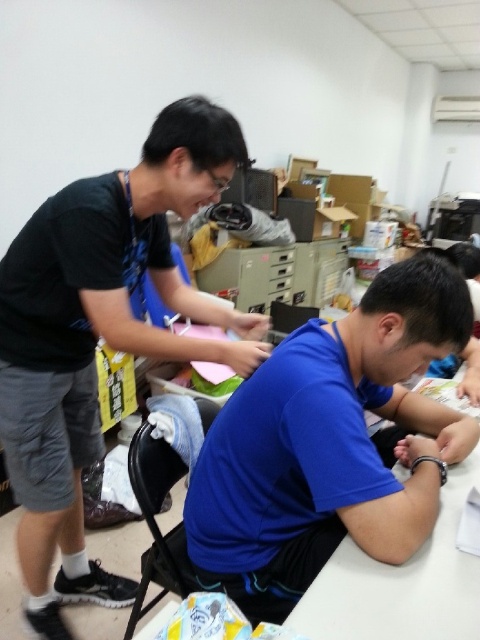
Between blue matte shirt at center and black matte shirt at left, which one has more height?

With more height is black matte shirt at left.

Is blue matte shirt at center shorter than black matte shirt at left?

Yes, blue matte shirt at center is shorter than black matte shirt at left.

Is point (382, 512) closer to camera compared to point (35, 460)?

Yes, it is.

Where is `blue matte shirt at center`? blue matte shirt at center is located at coordinates (331, 444).

Is point (263, 440) positioned in front of point (444, 564)?

No, (263, 440) is behind (444, 564).

Is point (403, 280) behind point (339, 598)?

Yes, point (403, 280) is behind point (339, 598).

Who is more forward, (355, 492) or (445, 563)?

Point (355, 492)

What are the coordinates of `blue matte shirt at center` in the screenshot? It's located at 331,444.

Can you confirm if black matte shirt at left is taller than white glossy table at lower center?

Correct, black matte shirt at left is much taller as white glossy table at lower center.

Does black matte shirt at left have a greater width compared to white glossy table at lower center?

Correct, the width of black matte shirt at left exceeds that of white glossy table at lower center.

Is point (242, 358) farther from camera compared to point (459, 588)?

Yes, it is.

Where is `black matte shirt at left`? The height and width of the screenshot is (640, 480). black matte shirt at left is located at coordinates (100, 333).